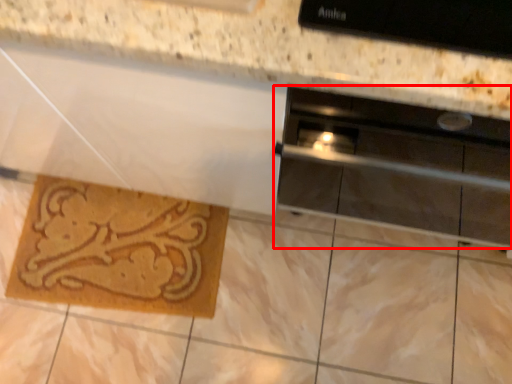
Question: Considering the relative positions of home appliance (annotated by the red box) and doormat in the image provided, where is home appliance (annotated by the red box) located with respect to the staircase?

Choices:
 (A) right
 (B) left

Answer: (A)